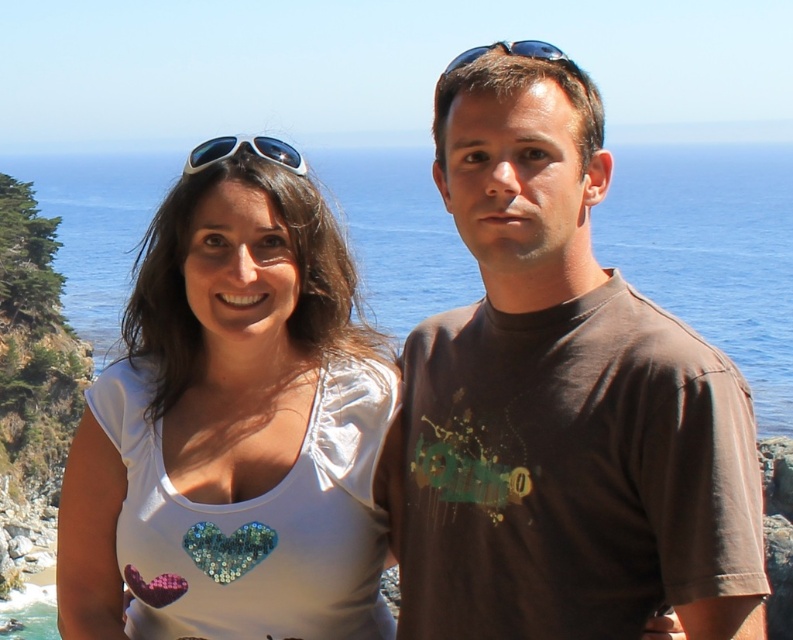
You are standing in front of the ocean with two people nearby. There is a specific point marked at coordinates point (418,358). If you want to reach that point quickly, which direction should you move relative to the two people?

The point (418,358) is 32.97 meters away from the viewer, so you should move forward towards the ocean to reach it quickly, as the two people are positioned between you and the point.

You are a photographer trying to capture a closeup of the white sequined heart at center and the blue water at center. Given that your camera can only focus on objects wider than 10 cm, can both objects be captured clearly in the same shot?

The white sequined heart at center is narrower than the blue water at center. Since the white sequined heart at center has a width less than 10 cm, it might not be captured clearly, while the blue water at center is wider and could be in focus. However, since the question asks if both can be captured clearly, the answer would be no because the white sequined heart at center may not meet the minimum width requirement.